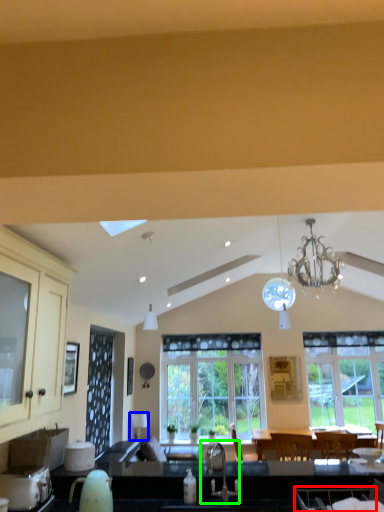
Question: Which object is the closest to the armchair (highlighted by a red box)? Choose among these: lamp (highlighted by a blue box) or sink (highlighted by a green box).

Choices:
 (A) lamp
 (B) sink

Answer: (B)